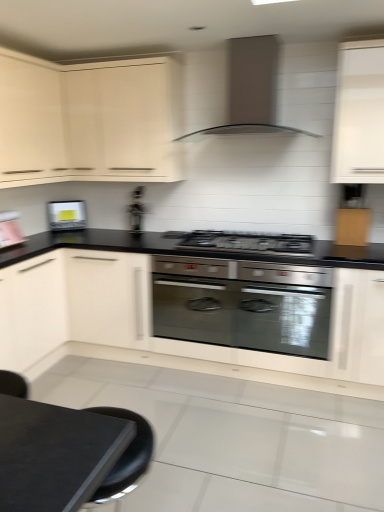
Question: Are satin black gas stove at center and metallic silver toaster at center located far from each other?

Choices:
 (A) yes
 (B) no

Answer: (B)

Question: Is satin black gas stove at center aimed at metallic silver toaster at center?

Choices:
 (A) yes
 (B) no

Answer: (B)

Question: Is satin black gas stove at center facing away from metallic silver toaster at center?

Choices:
 (A) yes
 (B) no

Answer: (B)

Question: From the image's perspective, is satin black gas stove at center below metallic silver toaster at center?

Choices:
 (A) yes
 (B) no

Answer: (A)

Question: From a real-world perspective, does satin black gas stove at center sit lower than metallic silver toaster at center?

Choices:
 (A) no
 (B) yes

Answer: (B)

Question: From a real-world perspective, is satin black gas stove at center physically located above or below matte silver toaster at left?

Choices:
 (A) above
 (B) below

Answer: (B)

Question: In the image, is satin black gas stove at center positioned in front of or behind matte silver toaster at left?

Choices:
 (A) front
 (B) behind

Answer: (A)

Question: From the image's perspective, is satin black gas stove at center above or below matte silver toaster at left?

Choices:
 (A) above
 (B) below

Answer: (B)

Question: From their relative heights in the image, would you say satin black gas stove at center is taller or shorter than matte silver toaster at left?

Choices:
 (A) short
 (B) tall

Answer: (A)

Question: From the image's perspective, is matte white cabinet at upper left, which appears as the 3th cabinetry when viewed from the right, positioned above or below matte silver toaster at left?

Choices:
 (A) below
 (B) above

Answer: (B)

Question: In the image, is matte white cabinet at upper left, which appears as the 3th cabinetry when viewed from the right, positioned in front of or behind matte silver toaster at left?

Choices:
 (A) front
 (B) behind

Answer: (A)

Question: Is point (6, 109) closer or farther from the camera than point (57, 228)?

Choices:
 (A) closer
 (B) farther

Answer: (A)

Question: Is matte white cabinet at upper left, which appears as the 3th cabinetry when viewed from the right, wider or thinner than matte silver toaster at left?

Choices:
 (A) thin
 (B) wide

Answer: (B)

Question: Considering the positions of point (21, 117) and point (379, 182), is point (21, 117) closer or farther from the camera than point (379, 182)?

Choices:
 (A) farther
 (B) closer

Answer: (A)

Question: In the image, is matte white cabinet at upper left, which ranks as the second cabinetry in left-to-right order, on the left side or the right side of white matte cabinet at upper right, positioned as the 1th cabinetry in right-to-left order?

Choices:
 (A) left
 (B) right

Answer: (A)